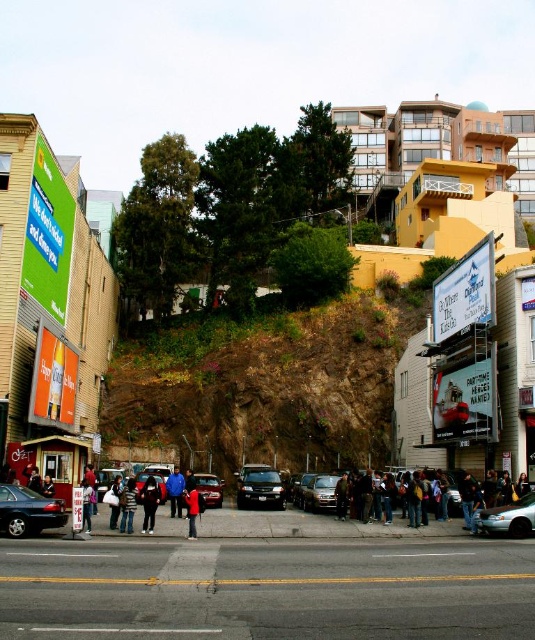
In the scene shown: Is satin black suv at center wider than satin black sedan at center?

Indeed, satin black suv at center has a greater width compared to satin black sedan at center.

Does satin black suv at center appear on the right side of satin black sedan at center?

Incorrect, satin black suv at center is not on the right side of satin black sedan at center.

Is point (248, 484) in front of point (309, 480)?

Yes, it is.

This screenshot has height=640, width=535. In order to click on satin black suv at center in this screenshot , I will do `click(259, 486)`.

Does point (426, 497) come in front of point (132, 492)?

No, (426, 497) is further to viewer.

From the picture: Between dark brown leather jacket at center and dark blue jeans at lower center, which one appears on the left side from the viewer's perspective?

dark blue jeans at lower center

I want to click on dark brown leather jacket at center, so click(x=453, y=493).

Between blue fabric jacket at center and dark blue shirt at center, which one has less height?

dark blue shirt at center is shorter.

Is blue fabric jacket at center positioned behind dark blue shirt at center?

Yes, it is.

Identify the location of blue fabric jacket at center. (x=174, y=492).